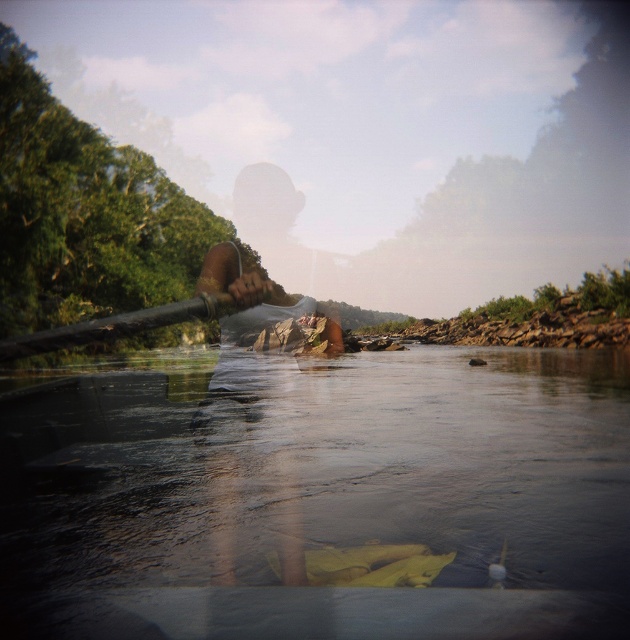
Question: Which of these objects is positioned closest to the wooden paddle at center?

Choices:
 (A) brown leather paddle at center
 (B) clear water at lower center

Answer: (B)

Question: Can you confirm if clear water at lower center is smaller than wooden paddle at center?

Choices:
 (A) no
 (B) yes

Answer: (B)

Question: Is clear water at lower center smaller than wooden paddle at center?

Choices:
 (A) no
 (B) yes

Answer: (B)

Question: Which of the following is the farthest from the observer?

Choices:
 (A) (110, 330)
 (B) (323, 317)
 (C) (238, 616)

Answer: (B)

Question: Does brown leather paddle at center have a lesser width compared to wooden paddle at center?

Choices:
 (A) yes
 (B) no

Answer: (A)

Question: Which object appears farthest from the camera in this image?

Choices:
 (A) wooden paddle at center
 (B) clear water at lower center
 (C) brown leather paddle at center

Answer: (C)